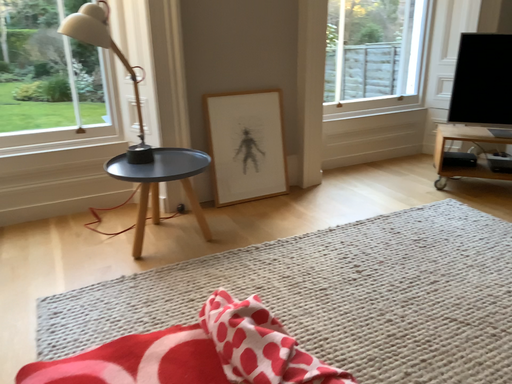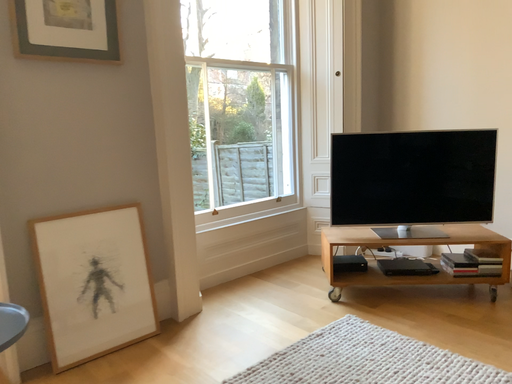
Question: Which way did the camera rotate in the video?

Choices:
 (A) rotated right
 (B) rotated left

Answer: (A)